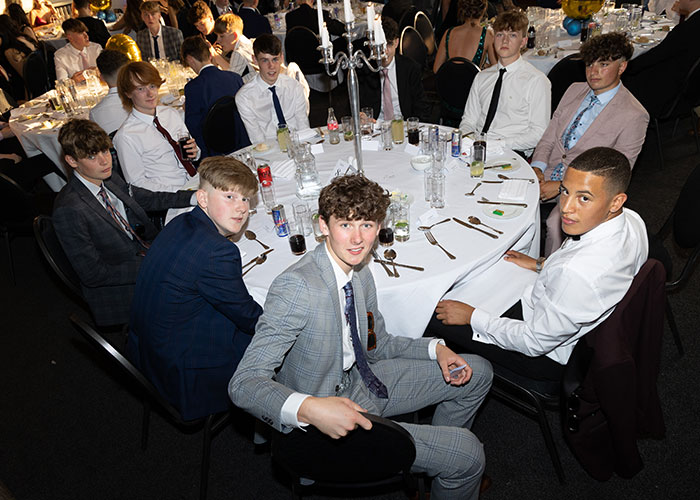
Identify the location of glass bottle of coca cola. The height and width of the screenshot is (500, 700). (334, 124).